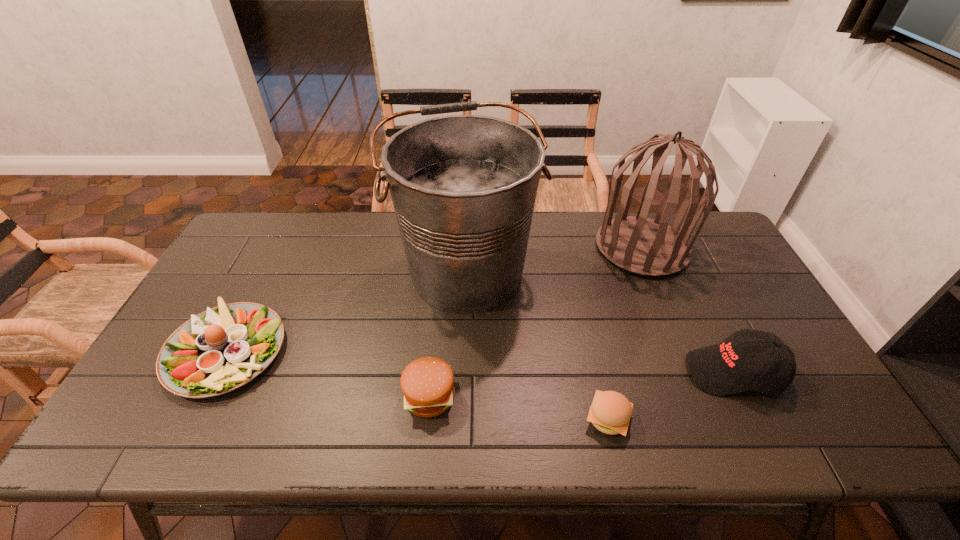
In order to click on vacant region between the birdcage and the shorter hamburger in this screenshot , I will do `click(625, 333)`.

Where is `free space between the third tallest object and the birdcage`? free space between the third tallest object and the birdcage is located at coordinates (687, 310).

Where is `empty space that is in between the leftmost object and the bucket`? This screenshot has height=540, width=960. empty space that is in between the leftmost object and the bucket is located at coordinates (347, 311).

Where is `free area in between the shorter hamburger and the left hamburger`? The width and height of the screenshot is (960, 540). free area in between the shorter hamburger and the left hamburger is located at coordinates (518, 407).

Where is `the third closest object relative to the left hamburger`? The image size is (960, 540). the third closest object relative to the left hamburger is located at coordinates (223, 348).

This screenshot has height=540, width=960. Identify the location of the fourth closest object relative to the third tallest object. (427, 383).

I want to click on vacant space that satisfies the following two spatial constraints: 1. on the back side of the bucket; 2. on the left side of the birdcage, so click(x=467, y=248).

What are the coordinates of `vacant space that satisfies the following two spatial constraints: 1. on the front side of the shorter hamburger; 2. on the left side of the leftmost object` in the screenshot? It's located at (193, 418).

This screenshot has width=960, height=540. What are the coordinates of `free spot that satisfies the following two spatial constraints: 1. on the front side of the salad plate; 2. on the right side of the shorter hamburger` in the screenshot? It's located at (193, 418).

At what (x,y) coordinates should I click in order to perform the action: click on vacant point that satisfies the following two spatial constraints: 1. on the back side of the fourth object from left to right; 2. on the right side of the birdcage. Please return your answer as a coordinate pair (x, y). This screenshot has height=540, width=960. Looking at the image, I should click on (569, 248).